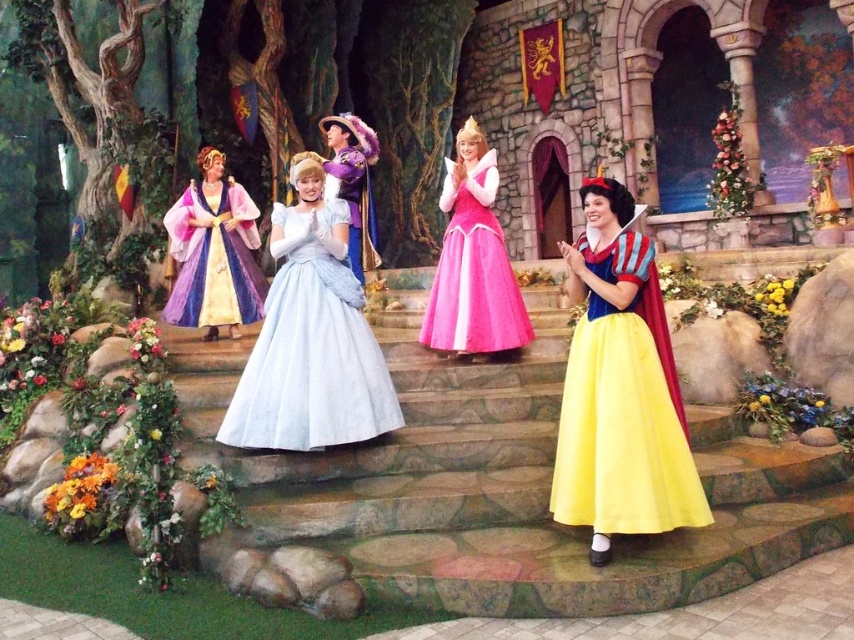
Question: Is the position of pink satin dress at center less distant than that of purple satin dress at center?

Choices:
 (A) no
 (B) yes

Answer: (B)

Question: Which point appears closest to the camera in this image?

Choices:
 (A) (208, 262)
 (B) (363, 186)

Answer: (B)

Question: Which point appears farthest from the camera in this image?

Choices:
 (A) (232, 211)
 (B) (335, 164)
 (C) (640, 532)

Answer: (A)

Question: Among these objects, which one is nearest to the camera?

Choices:
 (A) yellow satin dress at center
 (B) smooth stone stairs at center
 (C) light blue satin dress at center

Answer: (A)

Question: Is smooth stone stairs at center to the left of pink satin dress at center from the viewer's perspective?

Choices:
 (A) yes
 (B) no

Answer: (A)

Question: Is smooth stone stairs at center to the left of pink satin dress at center from the viewer's perspective?

Choices:
 (A) yes
 (B) no

Answer: (A)